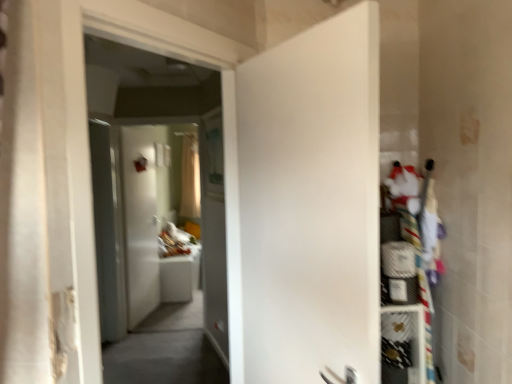
Question: Does point (111, 223) appear closer or farther from the camera than point (138, 193)?

Choices:
 (A) farther
 (B) closer

Answer: (B)

Question: In terms of height, does transparent glass screen door at left look taller or shorter compared to white glossy door at center, positioned as the first door in back-to-front order?

Choices:
 (A) short
 (B) tall

Answer: (B)

Question: Which is farther from the white matte door at center, which is the 2th door in back-to-front order?

Choices:
 (A) white mesh shelf at right, the first shelf in the bottom-to-top sequence
 (B) white glossy door at center, the 2th door from the right
 (C) transparent glass screen door at left
 (D) white fabric shelf at right, the second shelf positioned from the bottom
 (E) translucent fabric curtain at center

Answer: (E)

Question: Which of these objects is positioned closest to the white mesh shelf at right, which ranks as the second shelf in top-to-bottom order?

Choices:
 (A) white fabric shelf at right, the first shelf in the top-to-bottom sequence
 (B) transparent glass screen door at left
 (C) white glossy door at center, the 2th door from the right
 (D) white matte door at center, marked as the 2th door in a left-to-right arrangement
 (E) translucent fabric curtain at center

Answer: (A)